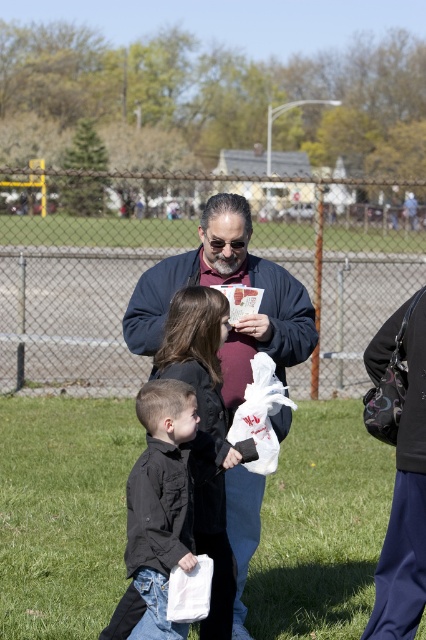
You are a photographer standing at the edge of the grassy field. You want to take a photo of the dark blue jacket at center and the black matte shirt at center. How far apart are these two items in inches?

A: The dark blue jacket at center is 34.12 inches from black matte shirt at center.

You are a photographer at the park and want to capture a photo of both the dark blue jacket at center and the black matte shirt at center. Since you want to ensure both are clearly visible, which object should you focus on first to account for their sizes?

The dark blue jacket at center is bigger than the black matte shirt at center, so you should focus on the dark blue jacket at center first as it occupies more space in the frame, making it easier to adjust the focus for the smaller object afterward.